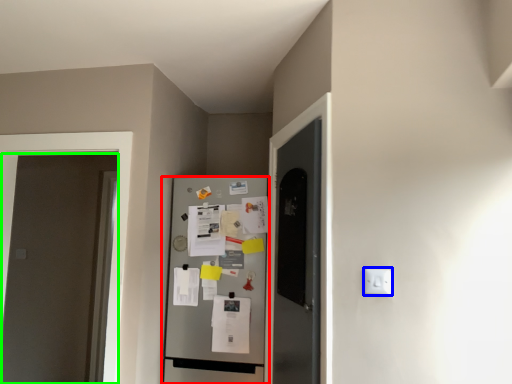
Question: Which object is the farthest from refrigerator (highlighted by a red box)? Choose among these: electric outlet (highlighted by a blue box) or door (highlighted by a green box).

Choices:
 (A) electric outlet
 (B) door

Answer: (B)